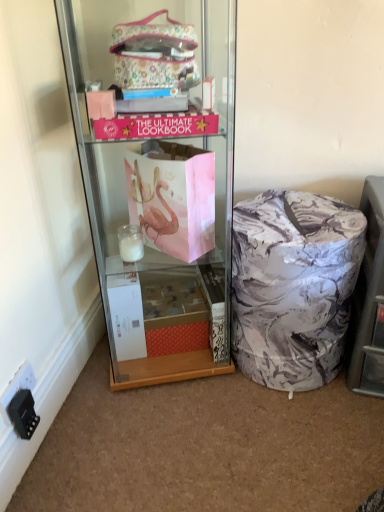
Question: Can you confirm if marble-patterned ottoman at lower right is positioned to the left of black plastic power outlet at lower left?

Choices:
 (A) no
 (B) yes

Answer: (A)

Question: From a real-world perspective, is marble-patterned ottoman at lower right beneath black plastic power outlet at lower left?

Choices:
 (A) yes
 (B) no

Answer: (B)

Question: Is marble-patterned ottoman at lower right facing away from black plastic power outlet at lower left?

Choices:
 (A) no
 (B) yes

Answer: (A)

Question: Could you tell me if marble-patterned ottoman at lower right is facing black plastic power outlet at lower left?

Choices:
 (A) yes
 (B) no

Answer: (B)

Question: Can you confirm if marble-patterned ottoman at lower right is smaller than black plastic power outlet at lower left?

Choices:
 (A) yes
 (B) no

Answer: (B)

Question: Is marble-patterned laundry basket at lower right to the left or to the right of matte pink paper bag at center in the image?

Choices:
 (A) right
 (B) left

Answer: (A)

Question: Relative to matte pink paper bag at center, is marble-patterned laundry basket at lower right in front or behind?

Choices:
 (A) front
 (B) behind

Answer: (B)

Question: From a real-world perspective, is marble-patterned laundry basket at lower right physically located above or below matte pink paper bag at center?

Choices:
 (A) above
 (B) below

Answer: (B)

Question: From the image's perspective, is marble-patterned laundry basket at lower right positioned above or below matte pink paper bag at center?

Choices:
 (A) above
 (B) below

Answer: (B)

Question: In terms of height, does marble-patterned ottoman at lower right look taller or shorter compared to black plastic power outlet at lower left?

Choices:
 (A) short
 (B) tall

Answer: (B)

Question: In terms of size, does marble-patterned ottoman at lower right appear bigger or smaller than black plastic power outlet at lower left?

Choices:
 (A) big
 (B) small

Answer: (A)

Question: In terms of width, does marble-patterned ottoman at lower right look wider or thinner when compared to black plastic power outlet at lower left?

Choices:
 (A) thin
 (B) wide

Answer: (B)

Question: In the image, is marble-patterned ottoman at lower right positioned in front of or behind black plastic power outlet at lower left?

Choices:
 (A) front
 (B) behind

Answer: (A)

Question: Is black plastic power outlet at lower left situated inside marble-patterned ottoman at lower right or outside?

Choices:
 (A) outside
 (B) inside

Answer: (A)

Question: Would you say black plastic power outlet at lower left is to the left or to the right of marble-patterned ottoman at lower right in the picture?

Choices:
 (A) left
 (B) right

Answer: (A)